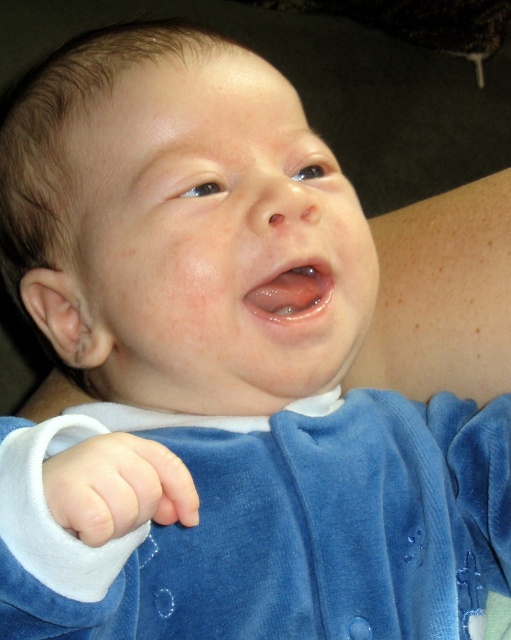
You are a photographer adjusting the lighting for a newborn photo session. You notice the velvet blue sleeve at lower left and the white soft fabric hand at lower left in the frame. Which object is located to the right of the other?

The velvet blue sleeve at lower left is positioned on the right side of white soft fabric hand at lower left.

Based on the scene description, where is the velvet blue sleeve at lower left located in terms of coordinates?

The velvet blue sleeve at lower left is located at coordinates point [94,560].

You are a photographer taking a close up of a baby. You notice the velvet blue sleeve at lower left and the white soft hand at center. Which object is positioned lower in the image?

The velvet blue sleeve at lower left is positioned below the white soft hand at center, so it is lower in the image.